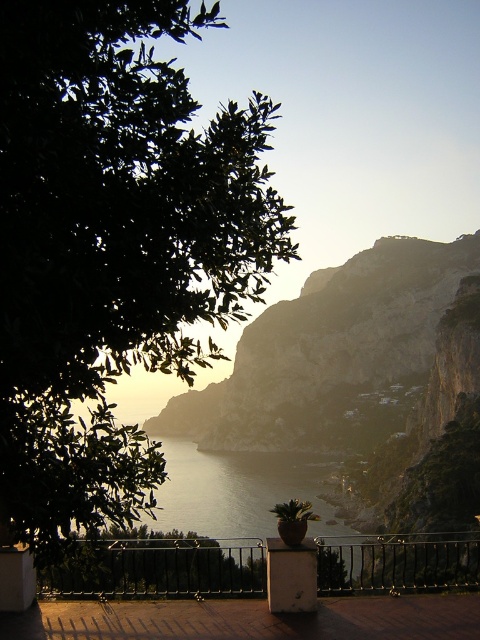
Question: Which object appears farthest from the camera in this image?

Choices:
 (A) rugged stone mountain at center
 (B) green leafy tree at upper left
 (C) black metal railing at center
 (D) silvery reflective water at center

Answer: (A)

Question: Is green leafy tree at upper left thinner than black metal railing at center?

Choices:
 (A) yes
 (B) no

Answer: (A)

Question: Estimate the real-world distances between objects in this image. Which object is closer to the silvery reflective water at center?

Choices:
 (A) black metal railing at center
 (B) green leafy tree at upper left

Answer: (A)

Question: Among these points, which one is nearest to the camera?

Choices:
 (A) (278, 314)
 (B) (194, 545)
 (C) (96, 209)
 (D) (252, 458)

Answer: (C)

Question: Does green leafy tree at upper left have a larger size compared to silvery reflective water at center?

Choices:
 (A) no
 (B) yes

Answer: (A)

Question: Can you confirm if green leafy tree at upper left is thinner than silvery reflective water at center?

Choices:
 (A) yes
 (B) no

Answer: (A)